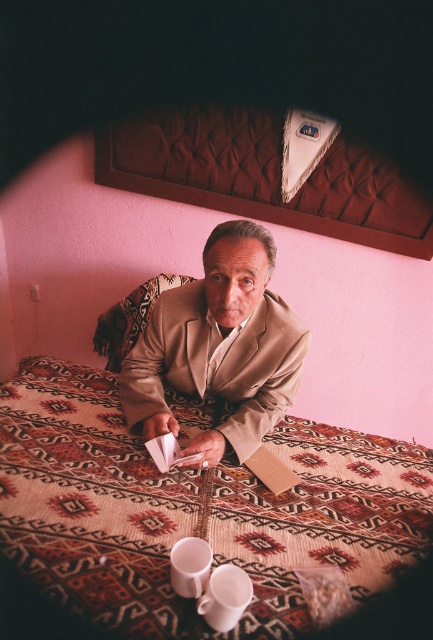
You are standing in the room and want to place a small lamp on the patterned fabric bed at center. Based on its position, can you estimate if the bed is positioned closer to the left or right side of the room?

The patterned fabric bed at center is located at point [191,509], which indicates it is closer to the right side of the room since the x coordinate is closer to 1.0.

Based on the scene description, where is the beige fabric at center located in terms of coordinates?

The beige fabric at center is located at coordinates approximately 0.498 in the x direction and 0.303 in the y direction.